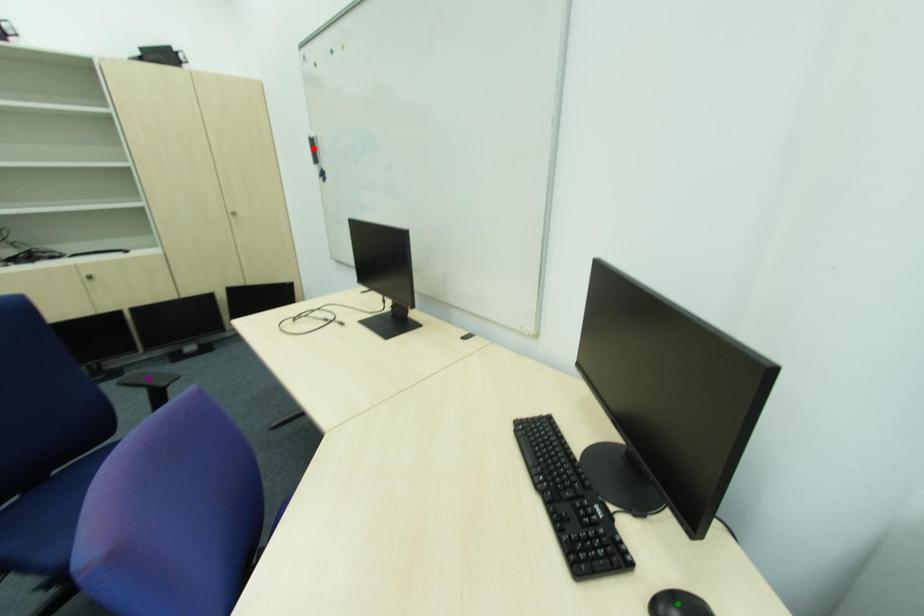
Order these from farthest to nearest:
- green point
- purple point
- red point

red point
purple point
green point